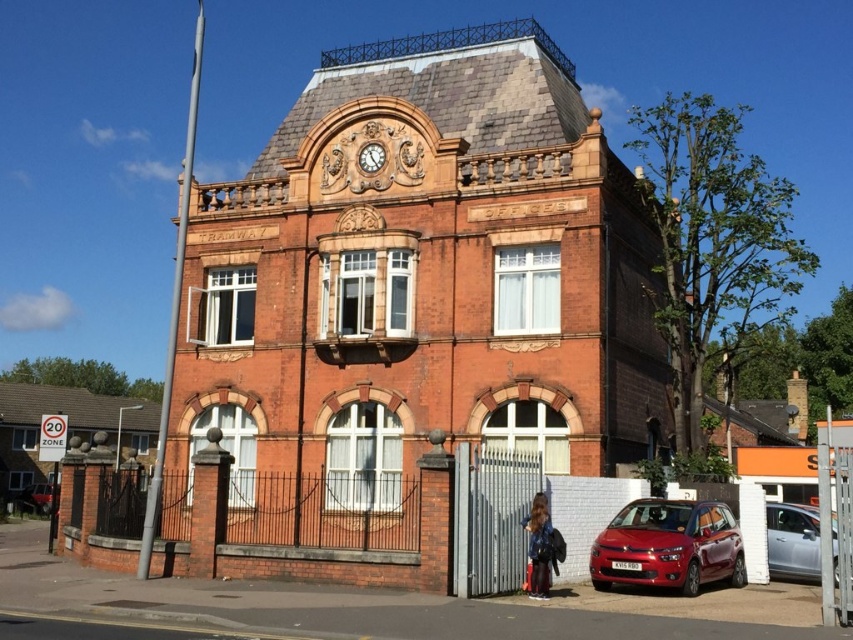
Is the position of satin silver car at lower right more distant than that of metallic red car at lower left?

No, it is not.

Between point (788, 509) and point (32, 508), which one is positioned behind?

Point (32, 508)

Does point (776, 512) come behind point (44, 500)?

That is False.

The height and width of the screenshot is (640, 853). What are the coordinates of `satin silver car at lower right` in the screenshot? It's located at (792, 540).

Does satin silver car at lower right appear on the right side of gold textured clock at upper center?

A: Correct, you'll find satin silver car at lower right to the right of gold textured clock at upper center.

From the picture: Does satin silver car at lower right have a larger size compared to gold textured clock at upper center?

Yes.

Between point (805, 552) and point (370, 148), which one is positioned behind?

The point (370, 148) is more distant.

I want to click on satin silver car at lower right, so click(x=792, y=540).

Is satin silver car at lower right positioned behind dark brown leather jacket at lower right?

No, it is not.

Between satin silver car at lower right and dark brown leather jacket at lower right, which one has more height?

satin silver car at lower right

Is point (817, 547) more distant than point (549, 552)?

Yes, point (817, 547) is behind point (549, 552).

At what (x,y) coordinates should I click in order to perform the action: click on satin silver car at lower right. Please return your answer as a coordinate pair (x, y). This screenshot has width=853, height=640. Looking at the image, I should click on (792, 540).